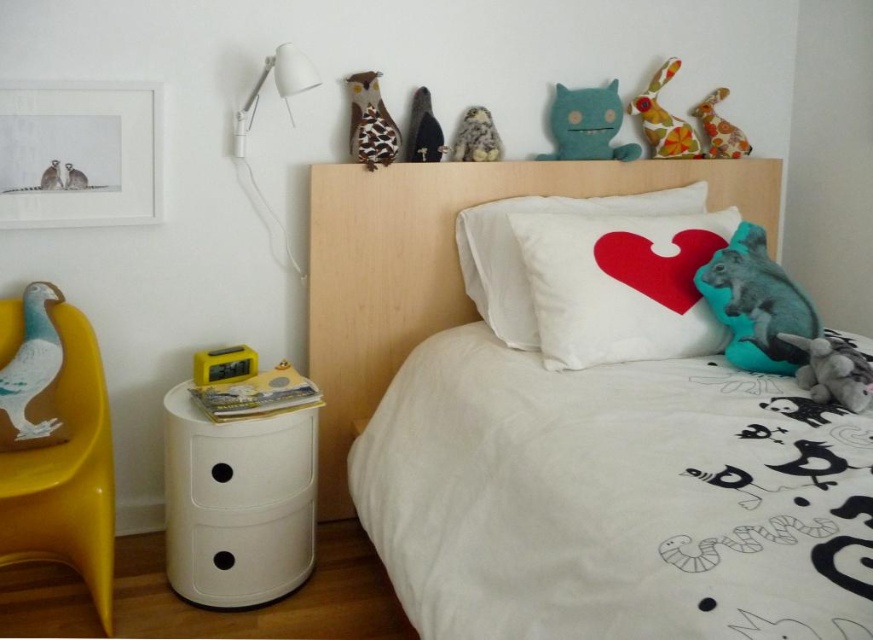
Does textured brown owl at upper center have a lesser width compared to gray furry animal at upper left?

Incorrect, textured brown owl at upper center's width is not less than gray furry animal at upper left's.

How much distance is there between textured brown owl at upper center and gray furry animal at upper left?

textured brown owl at upper center is 28.95 inches from gray furry animal at upper left.

Who is more forward, (356, 154) or (70, 179)?

Point (70, 179)

I want to click on textured brown owl at upper center, so click(x=369, y=122).

Is white cotton bed at center taller than soft blue plush at upper center?

Correct, white cotton bed at center is much taller as soft blue plush at upper center.

Is point (779, 166) positioned behind point (561, 129)?

Yes, it is.

What are the coordinates of `white cotton bed at center` in the screenshot? It's located at (568, 440).

Can you confirm if yellow plastic chair at lower left is bigger than fluffy gray stuffed animal at right?

Correct, yellow plastic chair at lower left is larger in size than fluffy gray stuffed animal at right.

Which is below, yellow plastic chair at lower left or fluffy gray stuffed animal at right?

Positioned lower is yellow plastic chair at lower left.

Who is more forward, (x=97, y=612) or (x=853, y=353)?

Point (x=853, y=353) is in front.

I want to click on yellow plastic chair at lower left, so click(64, 468).